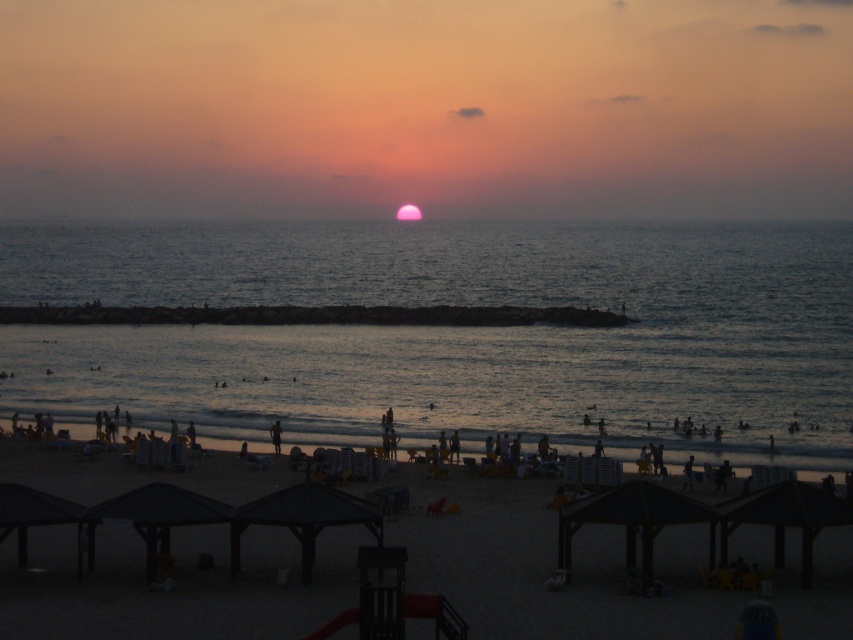
Between blue water at center and dark wooden umbrellas at center, which one appears on the right side from the viewer's perspective?

Positioned to the right is dark wooden umbrellas at center.

Can you confirm if blue water at center is positioned above dark wooden umbrellas at center?

Yes.

Does point (486, 404) come behind point (345, 573)?

Yes, point (486, 404) is behind point (345, 573).

At what (x,y) coordinates should I click in order to perform the action: click on blue water at center. Please return your answer as a coordinate pair (x, y). Looking at the image, I should click on (448, 330).

Which is behind, point (77, 240) or point (276, 452)?

Positioned behind is point (77, 240).

Between blue water at center and dark skin person at lower center, which one is positioned higher?

blue water at center is above.

Does point (445, 378) come behind point (273, 440)?

Yes.

At what (x,y) coordinates should I click in order to perform the action: click on blue water at center. Please return your answer as a coordinate pair (x, y). The width and height of the screenshot is (853, 640). Looking at the image, I should click on (448, 330).

Where is `dark wooden umbrellas at center`? This screenshot has height=640, width=853. dark wooden umbrellas at center is located at coordinates (550, 566).

Which is more to the right, dark wooden umbrellas at center or dark skin person at lower center?

Positioned to the right is dark wooden umbrellas at center.

The image size is (853, 640). Identify the location of dark wooden umbrellas at center. (550, 566).

Locate an element on the screen. dark wooden umbrellas at center is located at coordinates (550, 566).